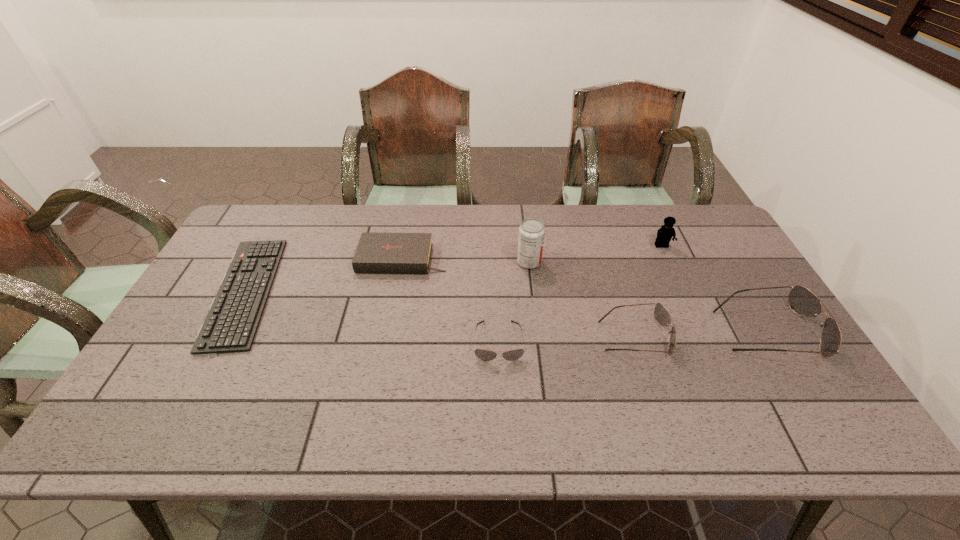
All sunglassess are currently evenly spaced. To continue this pattern, where would you add another sunglasses on the left? Please point out a vacant spot. Please provide its 2D coordinates. Your answer should be formatted as a tuple, i.e. [(x, y)], where the tuple contains the x and y coordinates of a point satisfying the conditions above.

[(360, 347)]